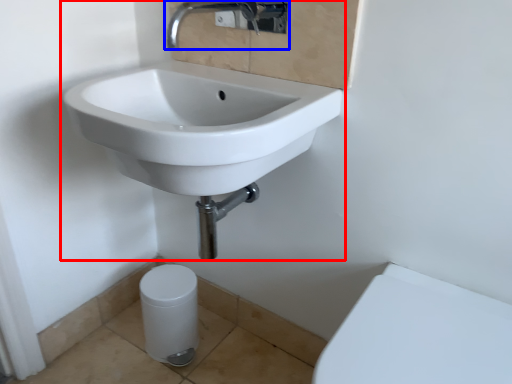
Question: Among these objects, which one is nearest to the camera, sink (highlighted by a red box) or tap (highlighted by a blue box)?

Choices:
 (A) sink
 (B) tap

Answer: (A)